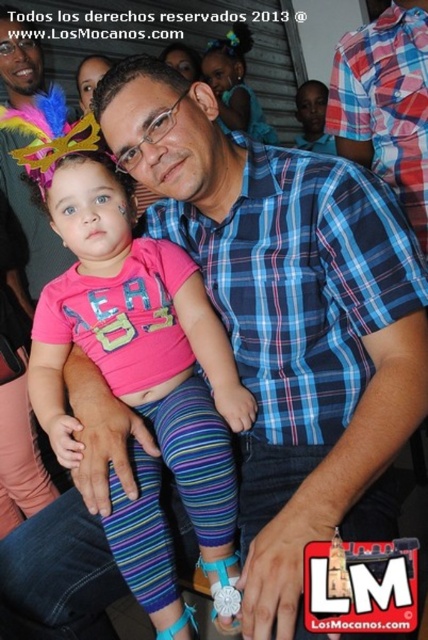
This screenshot has width=428, height=640. Describe the element at coordinates (116, 292) in the screenshot. I see `pink fabric shirt at center` at that location.

Is pink fabric shirt at center to the right of pink fabric dress at center from the viewer's perspective?

No, pink fabric shirt at center is not to the right of pink fabric dress at center.

This screenshot has width=428, height=640. What do you see at coordinates (116, 292) in the screenshot?
I see `pink fabric shirt at center` at bounding box center [116, 292].

Where is `pink fabric shirt at center`? The height and width of the screenshot is (640, 428). pink fabric shirt at center is located at coordinates (116, 292).

Can you confirm if pink fabric shirt at center is wider than blue plaid shirt at center?

Yes, pink fabric shirt at center is wider than blue plaid shirt at center.

Is point (226, 586) positioned in front of point (359, 120)?

Yes.

Find the location of a particular element. pink fabric shirt at center is located at coordinates tap(116, 292).

Can you confirm if blue plaid shirt at center is smaller than pink fabric dress at center?

Indeed, blue plaid shirt at center has a smaller size compared to pink fabric dress at center.

Which of these two, blue plaid shirt at center or pink fabric dress at center, stands taller?

pink fabric dress at center

Is point (403, 3) less distant than point (210, 42)?

Yes, point (403, 3) is in front of point (210, 42).

The height and width of the screenshot is (640, 428). In order to click on blue plaid shirt at center in this screenshot , I will do `click(386, 104)`.